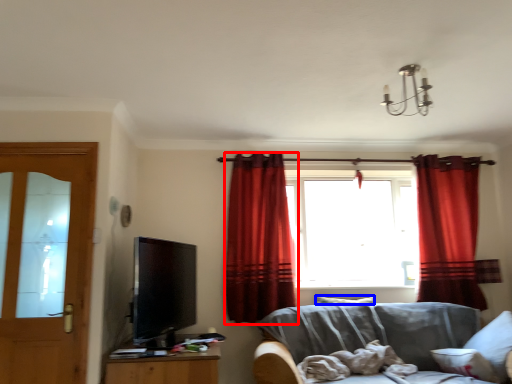
Question: Which object appears closest to the camera in this image, curtain (highlighted by a red box) or pillow (highlighted by a blue box)?

Choices:
 (A) curtain
 (B) pillow

Answer: (A)